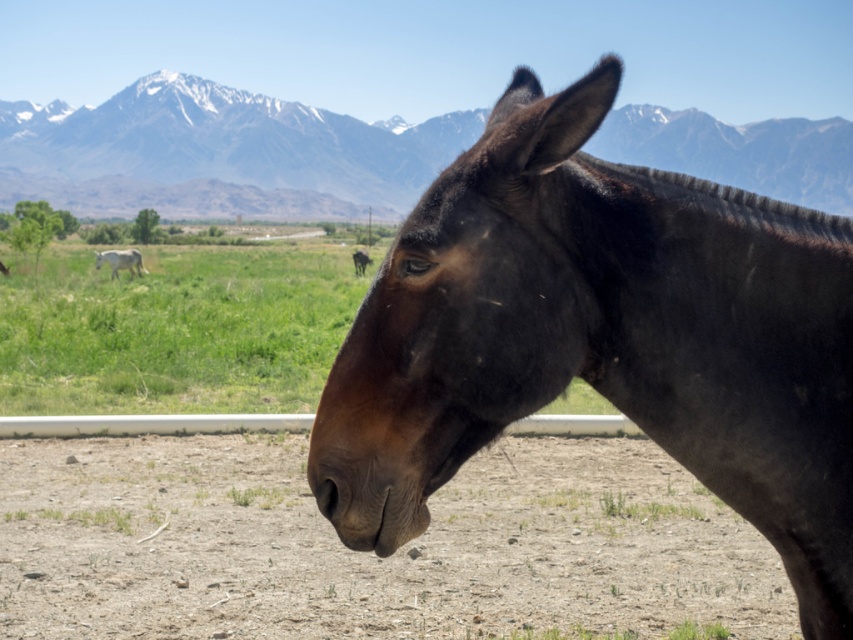
Looking at the image, which object is positioned to the right of the other between the brown glossy horse at center and the snowy rock mountain at upper center?

The brown glossy horse at center is positioned to the right of the snowy rock mountain at upper center.

You are a photographer standing in front of the brown glossy horse at center and the green grass at center in the image. Which object would appear larger in your camera viewfinder?

The brown glossy horse at center would appear larger in the camera viewfinder because it is closer to the viewer than the green grass at center.